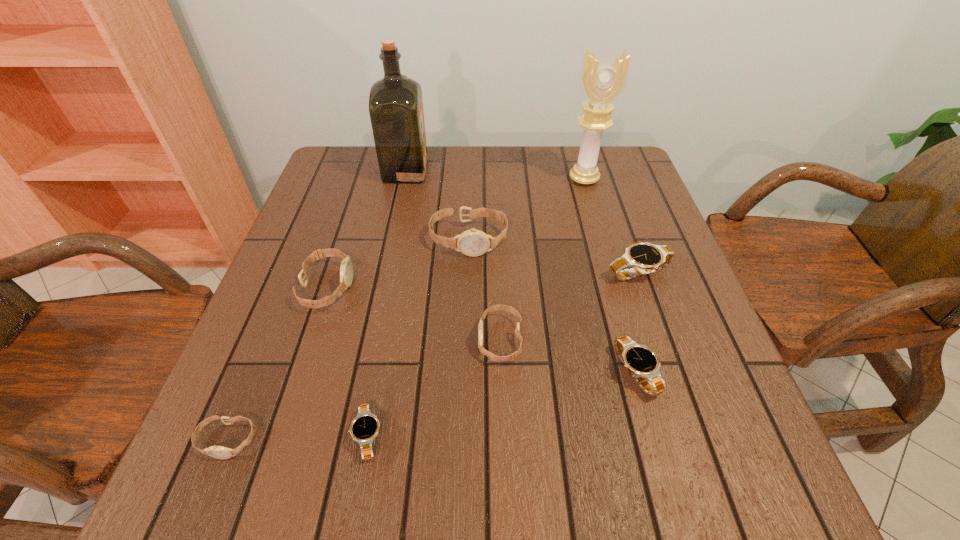
Locate an element on the screen. This screenshot has width=960, height=540. empty location between the liquor and the farthest beige watch is located at coordinates (437, 205).

At what (x,y) coordinates should I click in order to perform the action: click on object that is the closest to the sixth shortest watch. Please return your answer as a coordinate pair (x, y). Looking at the image, I should click on (473, 242).

Image resolution: width=960 pixels, height=540 pixels. Find the location of `the third closest object relative to the award`. the third closest object relative to the award is located at coordinates (396, 112).

In order to click on watch that is the third closest one to the award in this screenshot , I will do `click(513, 356)`.

Locate which watch is the third closest to the second farthest black watch. Please provide its 2D coordinates. Your answer should be formatted as a tuple, i.e. [(x, y)], where the tuple contains the x and y coordinates of a point satisfying the conditions above.

[(473, 242)]

Select which beige watch is the third closest to the third biggest beige watch. Please provide its 2D coordinates. Your answer should be formatted as a tuple, i.e. [(x, y)], where the tuple contains the x and y coordinates of a point satisfying the conditions above.

[(219, 452)]

Identify which beige watch is the second closest to the liquor. Please provide its 2D coordinates. Your answer should be formatted as a tuple, i.e. [(x, y)], where the tuple contains the x and y coordinates of a point satisfying the conditions above.

[(346, 270)]

This screenshot has width=960, height=540. Find the location of `black watch that is the third nearest to the third biggest beige watch`. black watch that is the third nearest to the third biggest beige watch is located at coordinates (645, 258).

The width and height of the screenshot is (960, 540). In order to click on black watch that is the third closest to the second tallest watch in this screenshot , I will do `click(645, 258)`.

The height and width of the screenshot is (540, 960). Find the location of `free space in the image that satisfies the following two spatial constraints: 1. on the label of the liquor; 2. on the face of the smallest beige watch`. free space in the image that satisfies the following two spatial constraints: 1. on the label of the liquor; 2. on the face of the smallest beige watch is located at coordinates (348, 440).